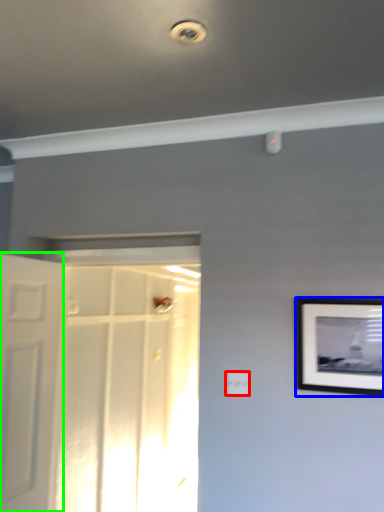
Question: Which is farther away from electric outlet (highlighted by a red box)? picture frame (highlighted by a blue box) or door (highlighted by a green box)?

Choices:
 (A) picture frame
 (B) door

Answer: (B)